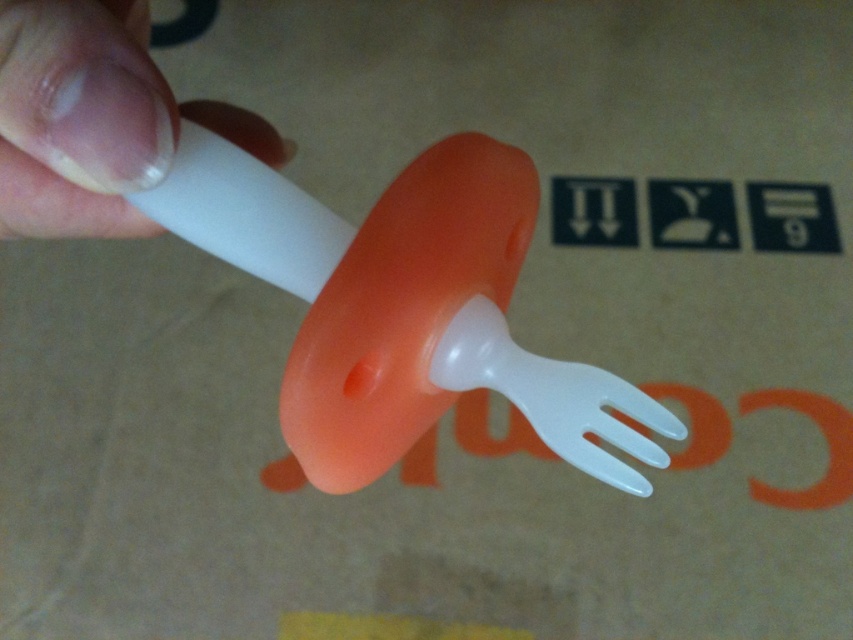
Is translucent plastic fork at center shorter than white matte plastic at upper left?

In fact, translucent plastic fork at center may be taller than white matte plastic at upper left.

Between translucent plastic fork at center and white matte plastic at upper left, which one appears on the right side from the viewer's perspective?

translucent plastic fork at center

Locate an element on the screen. The image size is (853, 640). translucent plastic fork at center is located at coordinates (399, 307).

Where is `translucent plastic fork at center`? translucent plastic fork at center is located at coordinates (399, 307).